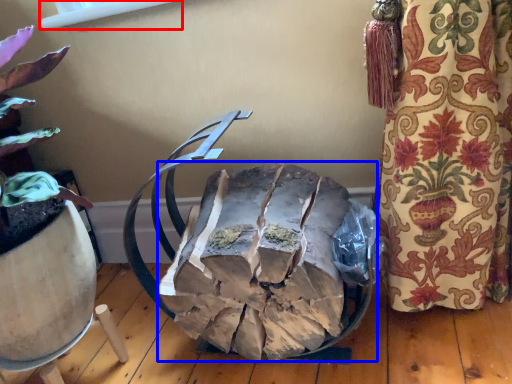
Question: Which object is closer to the camera taking this photo, window screen (highlighted by a red box) or waste (highlighted by a blue box)?

Choices:
 (A) window screen
 (B) waste

Answer: (B)